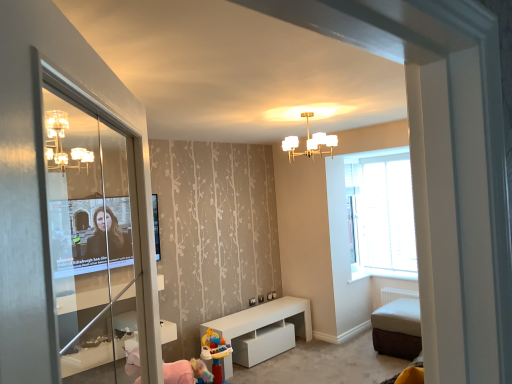
Question: Is white fabric ottoman at lower right taller or shorter than clear glass screen door at left?

Choices:
 (A) tall
 (B) short

Answer: (B)

Question: Looking at their shapes, would you say white fabric ottoman at lower right is wider or thinner than clear glass screen door at left?

Choices:
 (A) wide
 (B) thin

Answer: (A)

Question: Which object is the farthest from the white glass chandelier at upper center?

Choices:
 (A) white matte table at center
 (B) transparent glass window at right
 (C) clear glass screen door at left
 (D) white fabric ottoman at lower right

Answer: (A)

Question: Based on their relative distances, which object is nearer to the white matte table at center?

Choices:
 (A) white fabric ottoman at lower right
 (B) white glass chandelier at upper center
 (C) clear glass screen door at left
 (D) transparent glass window at right

Answer: (A)